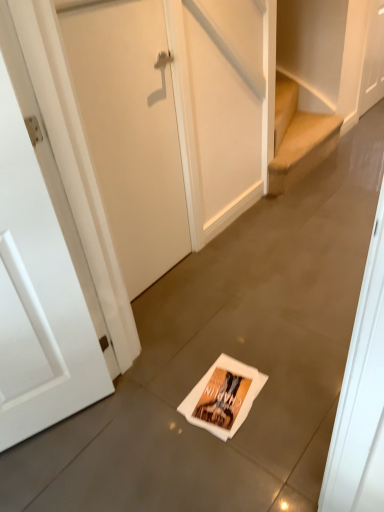
Question: From the image's perspective, is white matte door at center, the second door positioned from the back, above white matte door at left, which is counted as the 1th door, starting from the bottom?

Choices:
 (A) yes
 (B) no

Answer: (A)

Question: Is white matte door at center, the second door positioned from the back, taller than white matte door at left, arranged as the third door when viewed from the right?

Choices:
 (A) no
 (B) yes

Answer: (A)

Question: Is white matte door at center, the second door in the right-to-left sequence, behind white matte door at left, which is counted as the 1th door, starting from the bottom?

Choices:
 (A) no
 (B) yes

Answer: (B)

Question: Considering the relative positions of white matte door at center, which appears as the second door when viewed from the left, and white matte door at left, arranged as the third door when viewed from the right, in the image provided, is white matte door at center, which appears as the second door when viewed from the left, in front of white matte door at left, arranged as the third door when viewed from the right,?

Choices:
 (A) no
 (B) yes

Answer: (A)

Question: Is white matte door at center, which appears as the second door when viewed from the left, thinner than white matte door at left, arranged as the third door when viewed from the right?

Choices:
 (A) yes
 (B) no

Answer: (A)

Question: In terms of width, does white paper flyer at center look wider or thinner when compared to white matte door at upper right, the third door viewed from the left?

Choices:
 (A) thin
 (B) wide

Answer: (B)

Question: Is point (221, 373) closer or farther from the camera than point (370, 20)?

Choices:
 (A) farther
 (B) closer

Answer: (B)

Question: From the image's perspective, relative to white matte door at upper right, which appears as the first door when viewed from the right, is white paper flyer at center above or below?

Choices:
 (A) below
 (B) above

Answer: (A)

Question: Relative to white matte door at upper right, acting as the 3th door starting from the bottom, is white paper flyer at center in front or behind?

Choices:
 (A) behind
 (B) front

Answer: (B)

Question: In terms of height, does white matte door at upper right, which is the third door from front to back, look taller or shorter compared to white matte door at center, the second door positioned from the back?

Choices:
 (A) short
 (B) tall

Answer: (A)

Question: Looking at their shapes, would you say white matte door at upper right, the third door viewed from the left, is wider or thinner than white matte door at center, the second door positioned from the back?

Choices:
 (A) wide
 (B) thin

Answer: (A)

Question: Does point (367, 108) appear closer or farther from the camera than point (125, 71)?

Choices:
 (A) closer
 (B) farther

Answer: (B)

Question: From a real-world perspective, relative to white matte door at center, which appears as the second door when viewed from the left, is white matte door at upper right, which appears as the first door when viewed from the right, vertically above or below?

Choices:
 (A) above
 (B) below

Answer: (B)

Question: From their relative heights in the image, would you say white matte door at center, which appears as the second door when viewed from the left, is taller or shorter than white paper flyer at center?

Choices:
 (A) short
 (B) tall

Answer: (B)

Question: Which is correct: white matte door at center, marked as the 2th door in a top-to-bottom arrangement, is inside white paper flyer at center, or outside of it?

Choices:
 (A) outside
 (B) inside

Answer: (A)